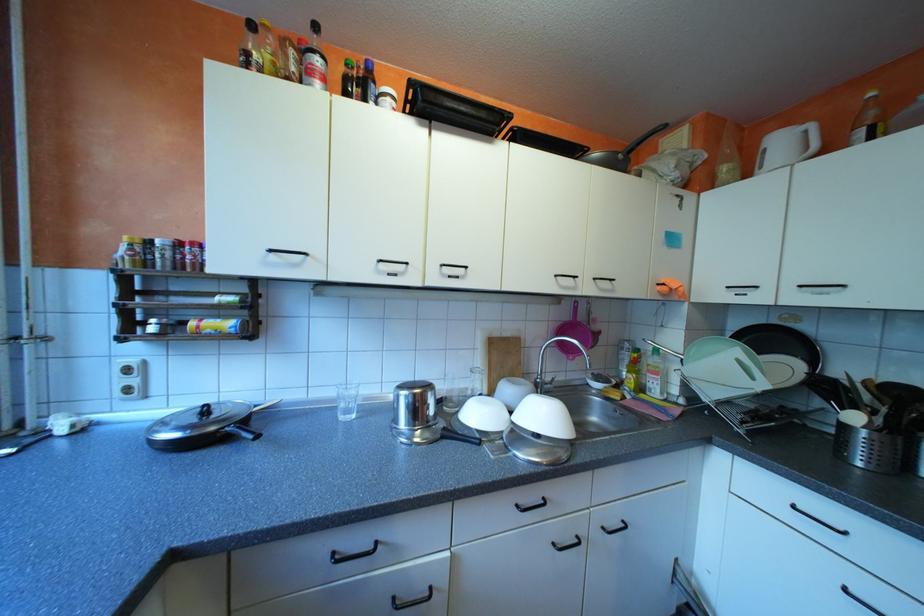
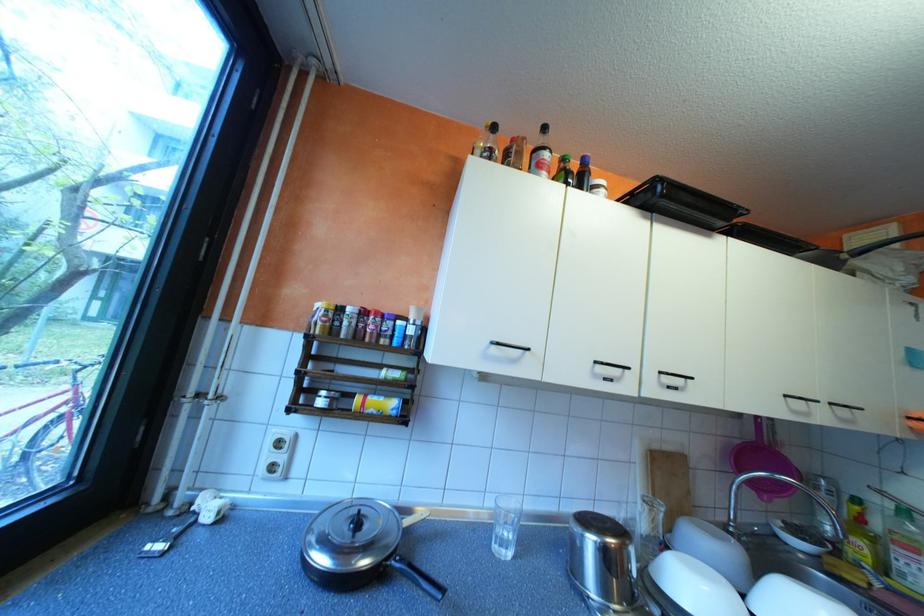
Locate, in the second image, the point that corresponds to (284,254) in the first image.

(505, 346)